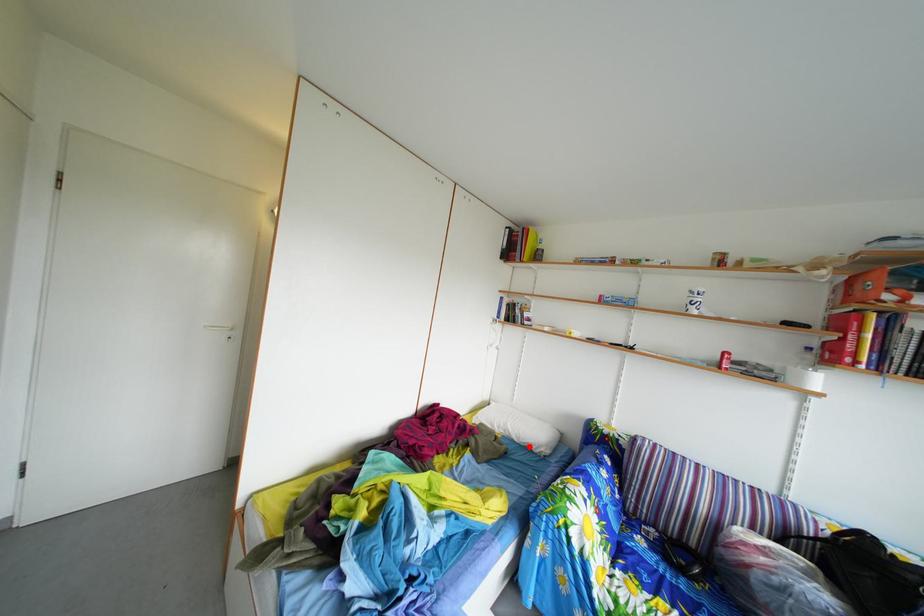
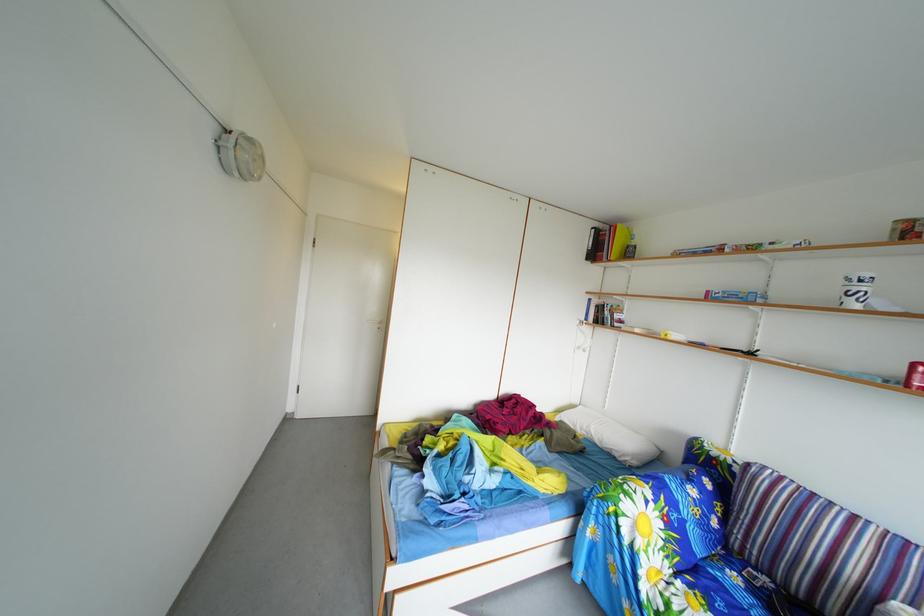
In the second image, find the point that corresponds to the highlighted location in the first image.

(612, 451)